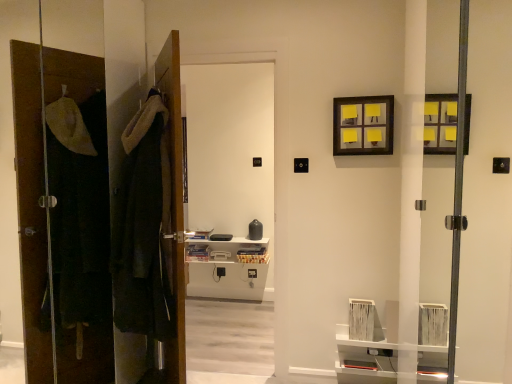
What do you see at coordinates (362, 125) in the screenshot? This screenshot has height=384, width=512. I see `matte black picture frame at upper right` at bounding box center [362, 125].

This screenshot has height=384, width=512. What do you see at coordinates (230, 219) in the screenshot? I see `white glossy door at center` at bounding box center [230, 219].

What are the coordinates of `wooden door at center, acting as the 1th door starting from the right` in the screenshot? It's located at (174, 202).

Find the location of a particular element. This screenshot has width=512, height=384. matte black picture frame at upper right is located at coordinates (362, 125).

Between wooden door at center, marked as the 2th door in a left-to-right arrangement, and velvet-like dark green robe at left, which one is positioned in front?

velvet-like dark green robe at left.

Considering the points (181, 264) and (168, 331), which point is in front, point (181, 264) or point (168, 331)?

Point (181, 264)

How different are the orientations of wooden door at center, acting as the 1th door starting from the right, and velvet-like dark green robe at left in degrees?

The angular difference between wooden door at center, acting as the 1th door starting from the right, and velvet-like dark green robe at left is 94.1 degrees.

The height and width of the screenshot is (384, 512). In order to click on door behind the velvet-like dark green robe at left in this screenshot , I will do `click(174, 202)`.

I want to click on screen door to the right of brown wooden door at left, marked as the first door in a left-to-right arrangement, so click(x=230, y=219).

How many degrees apart are the facing directions of brown wooden door at left, which appears as the second door when viewed from the right, and white glossy door at center?

The angular difference between brown wooden door at left, which appears as the second door when viewed from the right, and white glossy door at center is 91.7 degrees.

Can you confirm if brown wooden door at left, marked as the first door in a left-to-right arrangement, is positioned to the right of white glossy door at center?

Incorrect, brown wooden door at left, marked as the first door in a left-to-right arrangement, is not on the right side of white glossy door at center.

From a real-world perspective, who is located lower, brown wooden door at left, which appears as the second door when viewed from the right, or white glossy door at center?

In real-world perspective, white glossy door at center is lower.

From the image's perspective, is white glossy door at center beneath matte black picture frame at upper right?

Yes.

Is white glossy door at center far from matte black picture frame at upper right?

Absolutely, white glossy door at center is distant from matte black picture frame at upper right.

Which object is closer to the camera taking this photo, white glossy door at center or matte black picture frame at upper right?

matte black picture frame at upper right is in front.

Considering the positions of point (193, 345) and point (370, 139), is point (193, 345) closer or farther from the camera than point (370, 139)?

Point (193, 345) is farther from the camera than point (370, 139).

Which door is the 2nd one when counting from the left side of the matte black picture frame at upper right? Please provide its 2D coordinates.

[(40, 167)]

Is matte black picture frame at upper right smaller than brown wooden door at left, marked as the first door in a left-to-right arrangement?

Yes.

Which is in front, point (364, 147) or point (30, 70)?

The point (30, 70) is closer to the camera.

Looking at this image, is matte black picture frame at upper right located outside brown wooden door at left, which appears as the second door when viewed from the right?

Yes, matte black picture frame at upper right is outside of brown wooden door at left, which appears as the second door when viewed from the right.

Is white glossy door at center positioned in front of brown wooden door at left, marked as the first door in a left-to-right arrangement?

No, white glossy door at center is further to the viewer.

Which object is thinner, white glossy door at center or brown wooden door at left, which appears as the second door when viewed from the right?

brown wooden door at left, which appears as the second door when viewed from the right.

Is white glossy door at center facing towards brown wooden door at left, which appears as the second door when viewed from the right?

Yes, white glossy door at center is facing brown wooden door at left, which appears as the second door when viewed from the right.

From a real-world perspective, is white glossy door at center above or below brown wooden door at left, which appears as the second door when viewed from the right?

Clearly, from a real-world perspective, white glossy door at center is below brown wooden door at left, which appears as the second door when viewed from the right.

Considering the sizes of objects matte black picture frame at upper right and white glossy door at center in the image provided, who is wider, matte black picture frame at upper right or white glossy door at center?

white glossy door at center.

From a real-world perspective, is matte black picture frame at upper right positioned above or below white glossy door at center?

In terms of real-world spatial position, matte black picture frame at upper right is above white glossy door at center.

Considering the relative sizes of matte black picture frame at upper right and white glossy door at center in the image provided, is matte black picture frame at upper right smaller than white glossy door at center?

Yes.

In order to click on robe behind the brown wooden door at left, which appears as the second door when viewed from the right in this screenshot , I will do `click(144, 227)`.

From a real-world perspective, is brown wooden door at left, which appears as the second door when viewed from the right, on top of velvet-like dark green robe at left?

Yes, from a real-world perspective, brown wooden door at left, which appears as the second door when viewed from the right, is over velvet-like dark green robe at left

In terms of size, does brown wooden door at left, marked as the first door in a left-to-right arrangement, appear bigger or smaller than velvet-like dark green robe at left?

Considering their sizes, brown wooden door at left, marked as the first door in a left-to-right arrangement, takes up more space than velvet-like dark green robe at left.

What's the angular difference between brown wooden door at left, marked as the first door in a left-to-right arrangement, and velvet-like dark green robe at left's facing directions?

There is a 64.1-degree angle between the facing directions of brown wooden door at left, marked as the first door in a left-to-right arrangement, and velvet-like dark green robe at left.

The image size is (512, 384). I want to click on robe above the wooden door at center, marked as the 2th door in a left-to-right arrangement (from a real-world perspective), so click(x=144, y=227).

The image size is (512, 384). I want to click on screen door that is under the brown wooden door at left, which appears as the second door when viewed from the right (from a real-world perspective), so click(230, 219).

From the image, which object appears to be farther from white glossy door at center, brown wooden door at left, which appears as the second door when viewed from the right, or matte black picture frame at upper right?

Based on the image, matte black picture frame at upper right appears to be further to white glossy door at center.

Looking at the image, which one is located further to brown wooden door at left, which appears as the second door when viewed from the right, wooden door at center, marked as the 2th door in a left-to-right arrangement, or velvet-like dark green robe at left?

wooden door at center, marked as the 2th door in a left-to-right arrangement, is positioned further to the anchor brown wooden door at left, which appears as the second door when viewed from the right.

Based on their spatial positions, is wooden door at center, acting as the 1th door starting from the right, or matte black picture frame at upper right closer to white glossy door at center?

Among the two, wooden door at center, acting as the 1th door starting from the right, is located nearer to white glossy door at center.

In the scene shown: From the image, which object appears to be nearer to wooden door at center, marked as the 2th door in a left-to-right arrangement, white glossy door at center or brown wooden door at left, marked as the first door in a left-to-right arrangement?

brown wooden door at left, marked as the first door in a left-to-right arrangement, is closer to wooden door at center, marked as the 2th door in a left-to-right arrangement.

Looking at the image, which one is located closer to brown wooden door at left, marked as the first door in a left-to-right arrangement, velvet-like dark green robe at left or white glossy door at center?

velvet-like dark green robe at left lies closer to brown wooden door at left, marked as the first door in a left-to-right arrangement, than the other object.

When comparing their distances from matte black picture frame at upper right, does brown wooden door at left, marked as the first door in a left-to-right arrangement, or white glossy door at center seem closer?

brown wooden door at left, marked as the first door in a left-to-right arrangement, lies closer to matte black picture frame at upper right than the other object.

Based on their spatial positions, is wooden door at center, marked as the 2th door in a left-to-right arrangement, or matte black picture frame at upper right closer to brown wooden door at left, marked as the first door in a left-to-right arrangement?

wooden door at center, marked as the 2th door in a left-to-right arrangement.

Which object lies nearer to the anchor point matte black picture frame at upper right, brown wooden door at left, marked as the first door in a left-to-right arrangement, or wooden door at center, acting as the 1th door starting from the right?

wooden door at center, acting as the 1th door starting from the right, is closer to matte black picture frame at upper right.

Image resolution: width=512 pixels, height=384 pixels. What are the coordinates of `robe situated between brown wooden door at left, which appears as the second door when viewed from the right, and matte black picture frame at upper right from left to right` in the screenshot? It's located at pyautogui.click(x=144, y=227).

At what (x,y) coordinates should I click in order to perform the action: click on door located between brown wooden door at left, which appears as the second door when viewed from the right, and matte black picture frame at upper right in the left-right direction. Please return your answer as a coordinate pair (x, y). The height and width of the screenshot is (384, 512). Looking at the image, I should click on (174, 202).

Where is `robe between brown wooden door at left, which appears as the second door when viewed from the right, and white glossy door at center from front to back`? This screenshot has width=512, height=384. robe between brown wooden door at left, which appears as the second door when viewed from the right, and white glossy door at center from front to back is located at coordinates (144, 227).

Locate an element on the screen. This screenshot has height=384, width=512. screen door between wooden door at center, acting as the 1th door starting from the right, and matte black picture frame at upper right, in the horizontal direction is located at coordinates (230, 219).